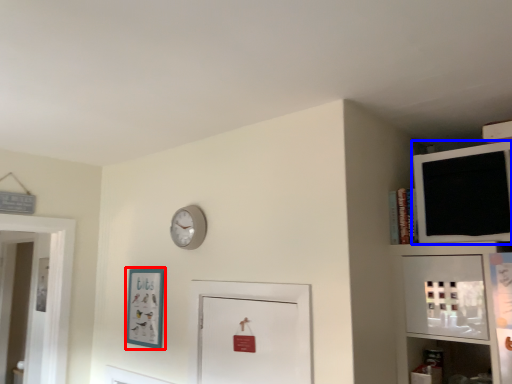
Question: Among these objects, which one is farthest to the camera, picture frame (highlighted by a red box) or medicine cabinet (highlighted by a blue box)?

Choices:
 (A) picture frame
 (B) medicine cabinet

Answer: (A)